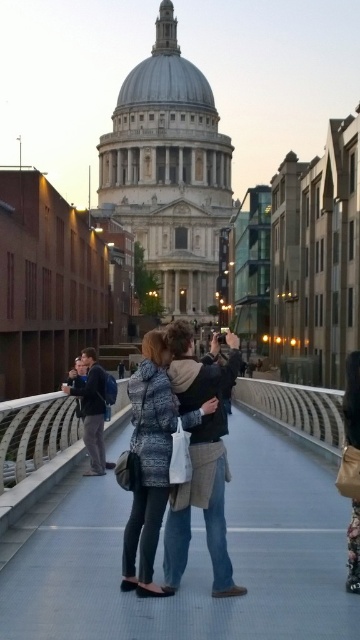
In the scene shown: Can you confirm if denim jacket at center is positioned below dark blue jacket at center?

No, denim jacket at center is not below dark blue jacket at center.

Between denim jacket at center and dark blue jacket at center, which one is positioned lower?

dark blue jacket at center is below.

Does point (227, 468) come closer to viewer compared to point (101, 394)?

Yes, it is in front of point (101, 394).

Locate an element on the screen. The image size is (360, 640). denim jacket at center is located at coordinates (200, 456).

Can you confirm if smooth concrete bridge at center is positioned above dark blue jacket at center?

Incorrect, smooth concrete bridge at center is not positioned above dark blue jacket at center.

Can you confirm if smooth concrete bridge at center is positioned to the right of dark blue jacket at center?

Yes, smooth concrete bridge at center is to the right of dark blue jacket at center.

Is point (196, 525) behind point (91, 388)?

No, (196, 525) is in front of (91, 388).

The width and height of the screenshot is (360, 640). I want to click on smooth concrete bridge at center, so click(x=189, y=557).

Who is shorter, smooth concrete bridge at center or denim jacket at center?

smooth concrete bridge at center is shorter.

Describe the element at coordinates (189, 557) in the screenshot. I see `smooth concrete bridge at center` at that location.

The width and height of the screenshot is (360, 640). What are the coordinates of `smooth concrete bridge at center` in the screenshot? It's located at click(x=189, y=557).